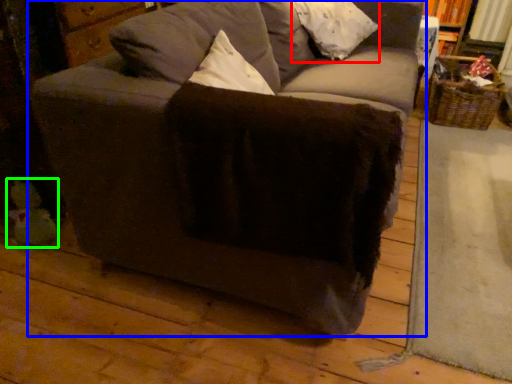
Question: Based on their relative distances, which object is farther from pillow (highlighted by a red box)? Choose from studio couch (highlighted by a blue box) and toy (highlighted by a green box).

Choices:
 (A) studio couch
 (B) toy

Answer: (B)